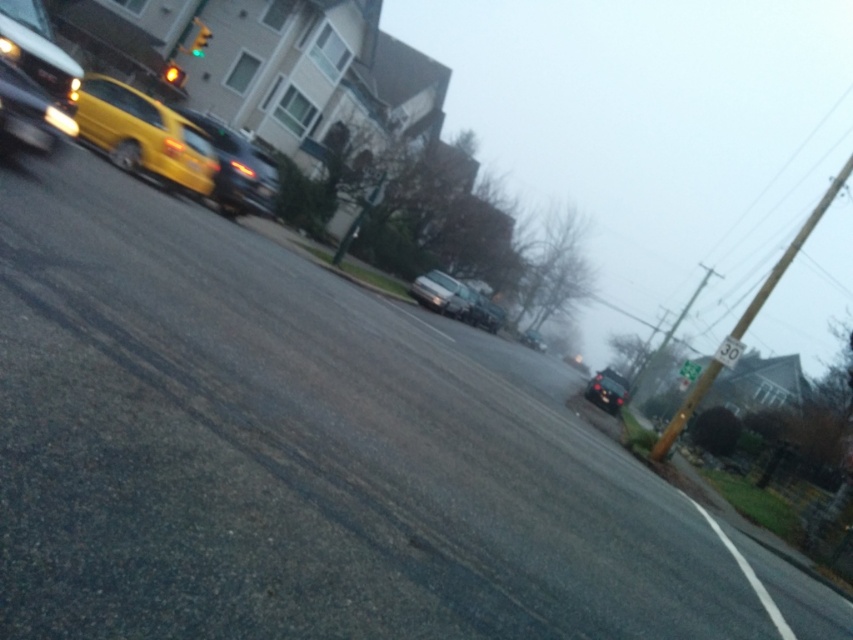
Question: Estimate the real-world distances between objects in this image. Which object is closer to the yellow matte taxi at left?

Choices:
 (A) shiny black sedan at center
 (B) green glass traffic light at upper center

Answer: (B)

Question: Considering the real-world distances, which object is closest to the yellow matte taxi at left?

Choices:
 (A) shiny silver sedan at center
 (B) green glass traffic light at upper center

Answer: (B)

Question: Is yellow matte taxi at left below shiny black sedan at center?

Choices:
 (A) no
 (B) yes

Answer: (A)

Question: Is yellow matte taxi at left wider than shiny black sedan at center?

Choices:
 (A) yes
 (B) no

Answer: (B)

Question: Is matte black car at left to the left of amber glass traffic light at upper left from the viewer's perspective?

Choices:
 (A) yes
 (B) no

Answer: (B)

Question: Which point is closer to the camera taking this photo?

Choices:
 (A) (241, 186)
 (B) (534, 348)
 (C) (202, 44)

Answer: (A)